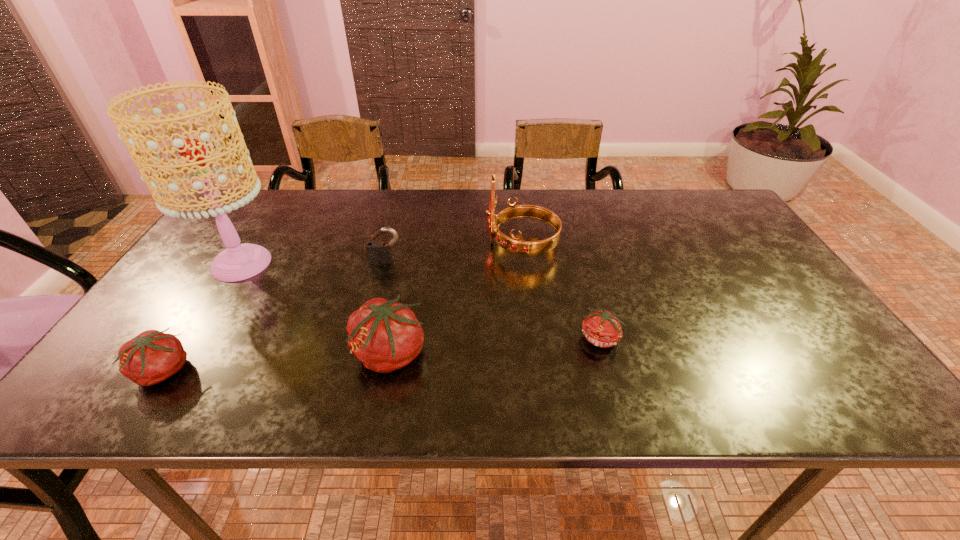
The height and width of the screenshot is (540, 960). I want to click on free space that satisfies the following two spatial constraints: 1. on the front-facing side of the tiara; 2. on the left side of the shortest tomato, so click(533, 339).

Identify the location of vacant space that satisfies the following two spatial constraints: 1. on the front-facing side of the second object from right to left; 2. on the back side of the rightmost tomato. This screenshot has height=540, width=960. (533, 339).